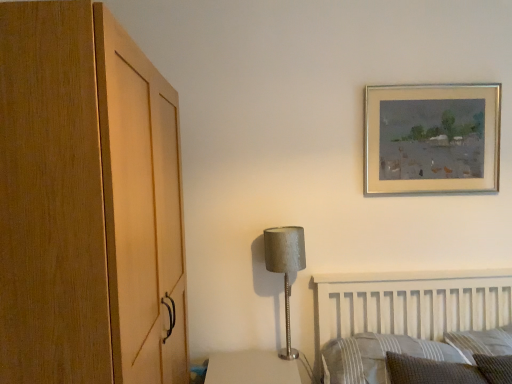
Question: Do you think gold metallic picture frame at upper right is within satin silver lamp at center, or outside of it?

Choices:
 (A) inside
 (B) outside

Answer: (B)

Question: In terms of height, does gold metallic picture frame at upper right look taller or shorter compared to satin silver lamp at center?

Choices:
 (A) short
 (B) tall

Answer: (A)

Question: Based on their relative distances, which object is farther from the striped fabric pillow at lower right, positioned as the first pillow in left-to-right order?

Choices:
 (A) woven fabric pillow at lower right, placed as the 2th pillow when sorted from left to right
 (B) textured gray pillow at lower right, the 3th pillow in the left-to-right sequence
 (C) gold metallic picture frame at upper right
 (D) satin silver lamp at center

Answer: (C)

Question: Estimate the real-world distances between objects in this image. Which object is closer to the gold metallic picture frame at upper right?

Choices:
 (A) satin silver lamp at center
 (B) textured gray pillow at lower right, the 1th pillow positioned from the right
 (C) woven fabric pillow at lower right, positioned as the 2th pillow in right-to-left order
 (D) striped fabric pillow at lower right, positioned as the first pillow in left-to-right order

Answer: (A)